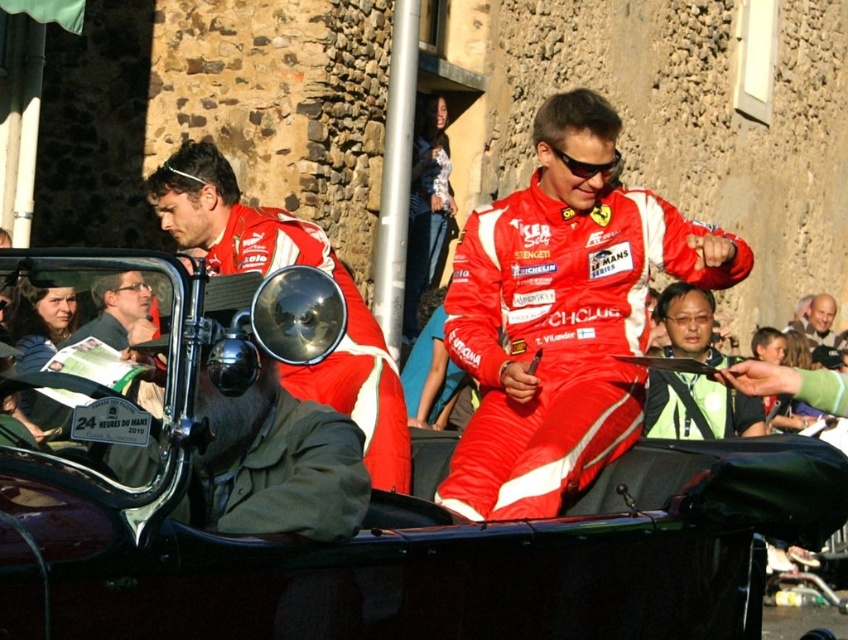
Question: Can you confirm if red fabric suit at center is wider than matte red racing suit at left?

Choices:
 (A) yes
 (B) no

Answer: (B)

Question: Is matte red racing suit at left above green reflective vest at center?

Choices:
 (A) no
 (B) yes

Answer: (B)

Question: Does green reflective vest at center have a lesser width compared to matte black jacket at left?

Choices:
 (A) no
 (B) yes

Answer: (A)

Question: Which of the following is the closest to the observer?

Choices:
 (A) shiny black car at center
 (B) matte red racing suit at left
 (C) red fabric suit at center
 (D) green reflective vest at center

Answer: (A)

Question: Estimate the real-world distances between objects in this image. Which object is farther from the green reflective vest at center?

Choices:
 (A) red fabric suit at center
 (B) shiny black car at center

Answer: (B)

Question: Which object appears closest to the camera in this image?

Choices:
 (A) matte red racing suit at left
 (B) shiny black car at center
 (C) green reflective vest at center

Answer: (B)